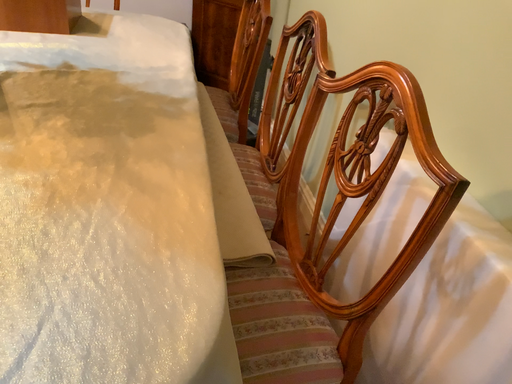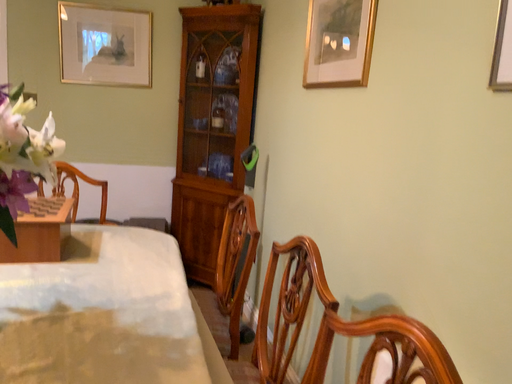
Question: Which way did the camera rotate in the video?

Choices:
 (A) rotated upward
 (B) rotated downward

Answer: (A)